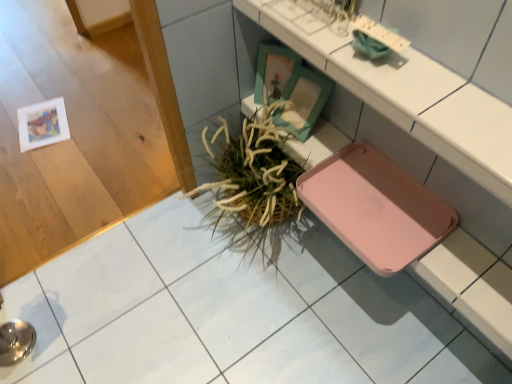
Question: Is pink plastic tray at lower right taller or shorter than green woven basket at center?

Choices:
 (A) tall
 (B) short

Answer: (B)

Question: Does point (386, 162) appear closer or farther from the camera than point (232, 144)?

Choices:
 (A) farther
 (B) closer

Answer: (B)

Question: Which object is the closest to the metallic silver bowl at lower left?

Choices:
 (A) pink plastic tray at lower right
 (B) green woven basket at center
 (C) matte white counter at center

Answer: (B)

Question: Considering the real-world distances, which object is farthest from the pink plastic tray at lower right?

Choices:
 (A) metallic silver bowl at lower left
 (B) green woven basket at center
 (C) matte white counter at center

Answer: (A)